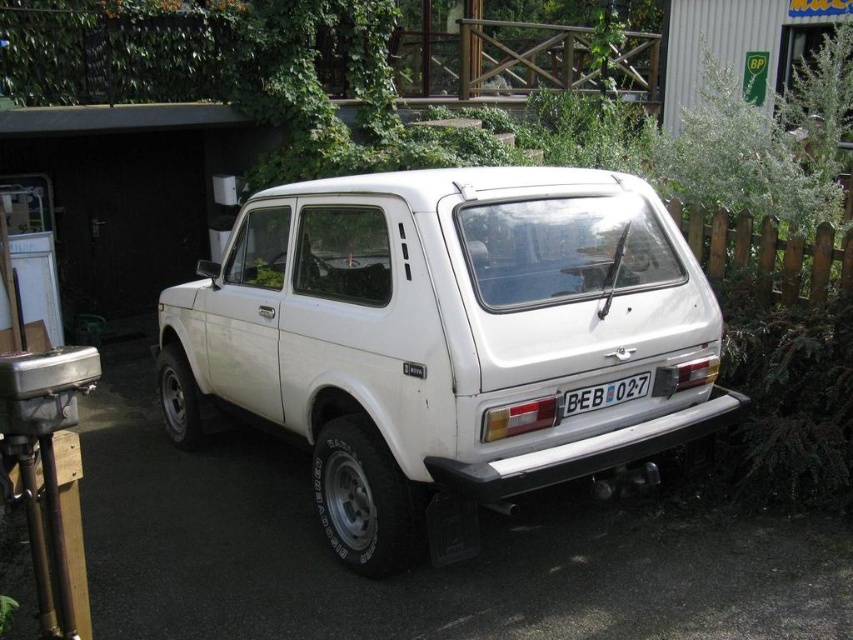
Question: Among these points, which one is farthest from the camera?

Choices:
 (A) (575, 394)
 (B) (509, 218)

Answer: (B)

Question: Which point appears closest to the camera in this image?

Choices:
 (A) (578, 397)
 (B) (497, 452)

Answer: (B)

Question: Among these objects, which one is nearest to the camera?

Choices:
 (A) white plastic license plate at rear
 (B) white matte suv at center

Answer: (B)

Question: Considering the relative positions of white matte suv at center and white plastic license plate at rear in the image provided, where is white matte suv at center located with respect to white plastic license plate at rear?

Choices:
 (A) right
 (B) left

Answer: (B)

Question: Does white matte suv at center have a greater width compared to white plastic license plate at rear?

Choices:
 (A) yes
 (B) no

Answer: (A)

Question: Is white matte suv at center thinner than white plastic license plate at rear?

Choices:
 (A) yes
 (B) no

Answer: (B)